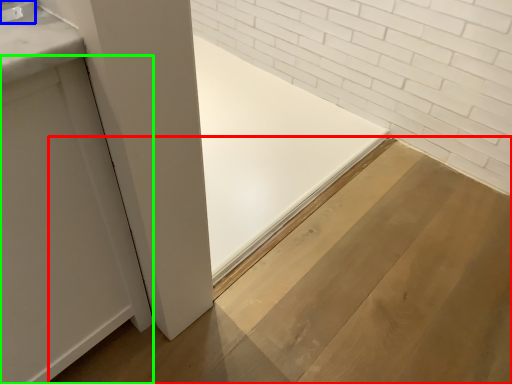
Question: Which object is the farthest from plywood (highlighted by a red box)? Choose among these: faucet (highlighted by a blue box) or door (highlighted by a green box).

Choices:
 (A) faucet
 (B) door

Answer: (A)